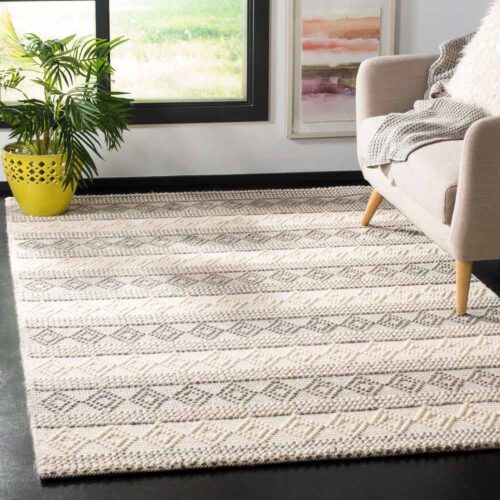
The width and height of the screenshot is (500, 500). I want to click on window panes, so click(64, 20), click(169, 32).